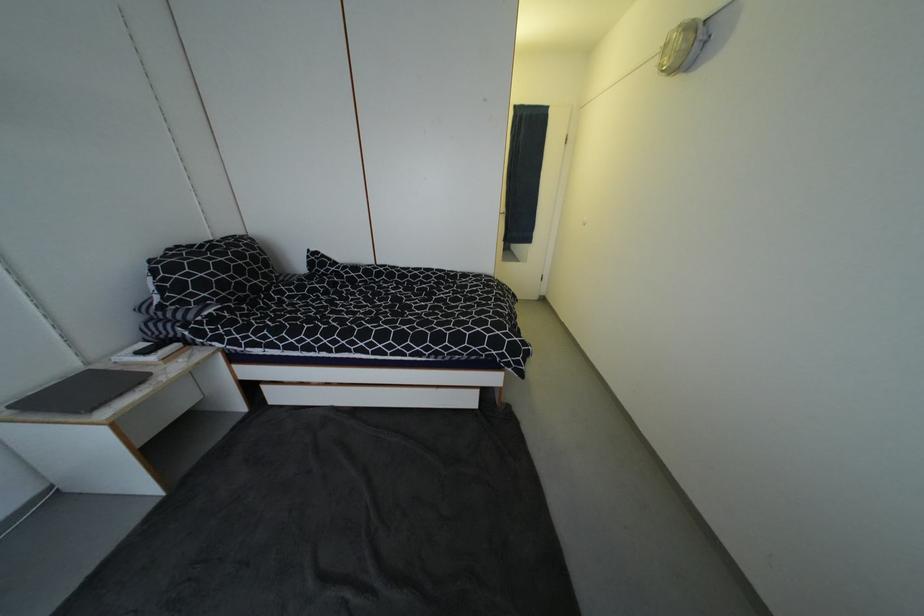
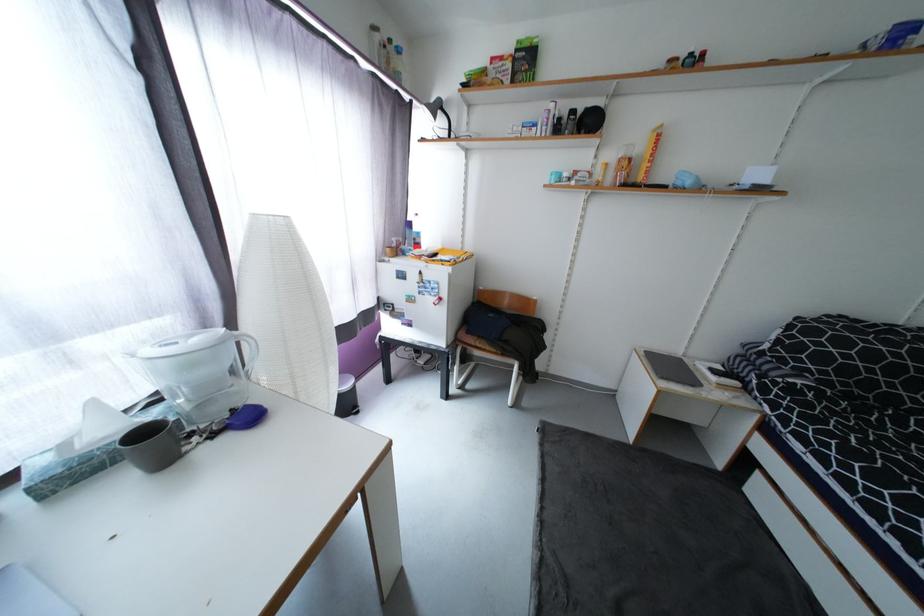
First-person continuous shooting, in which direction is the camera rotating?

The camera rotated toward left-down.